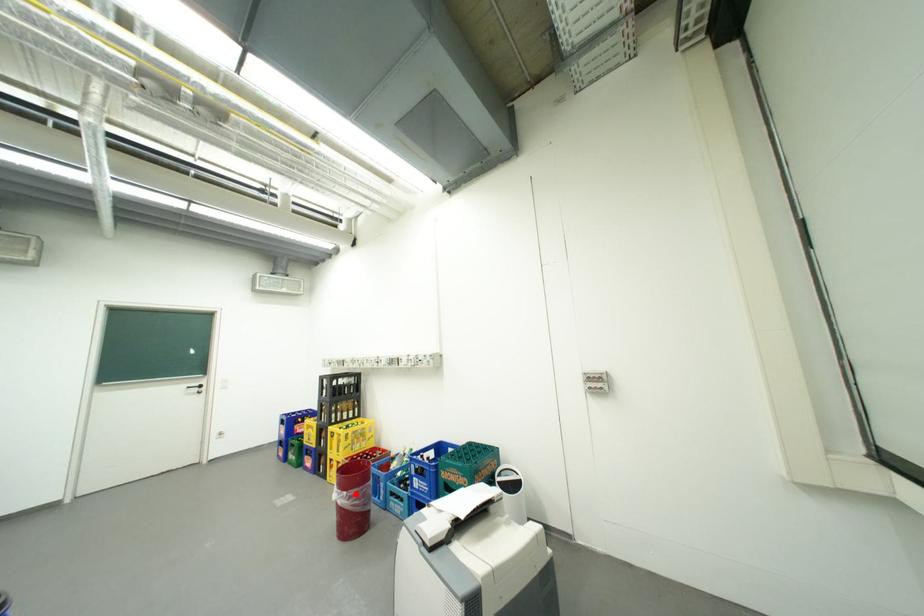
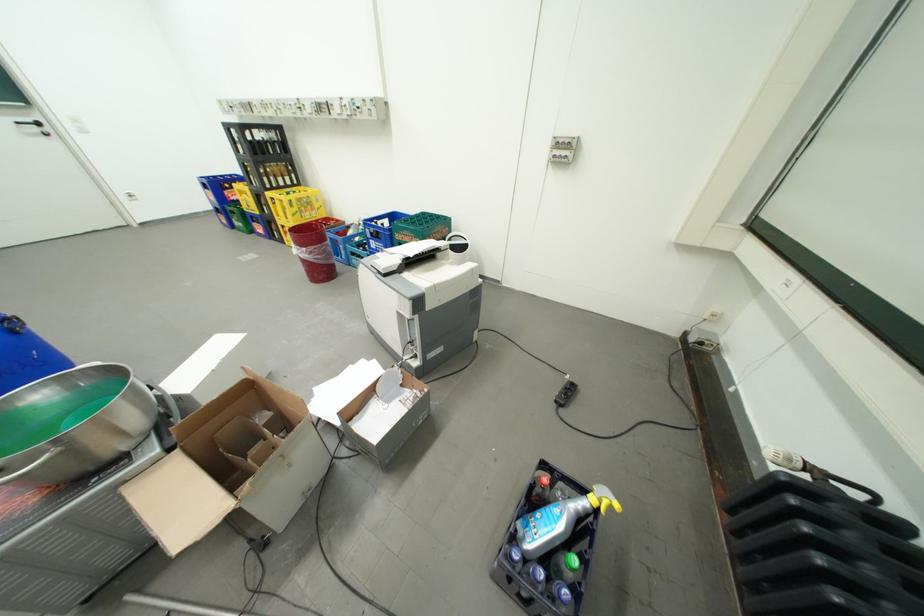
In the second image, find the point that corresponds to the highlighted location in the first image.

(314, 249)